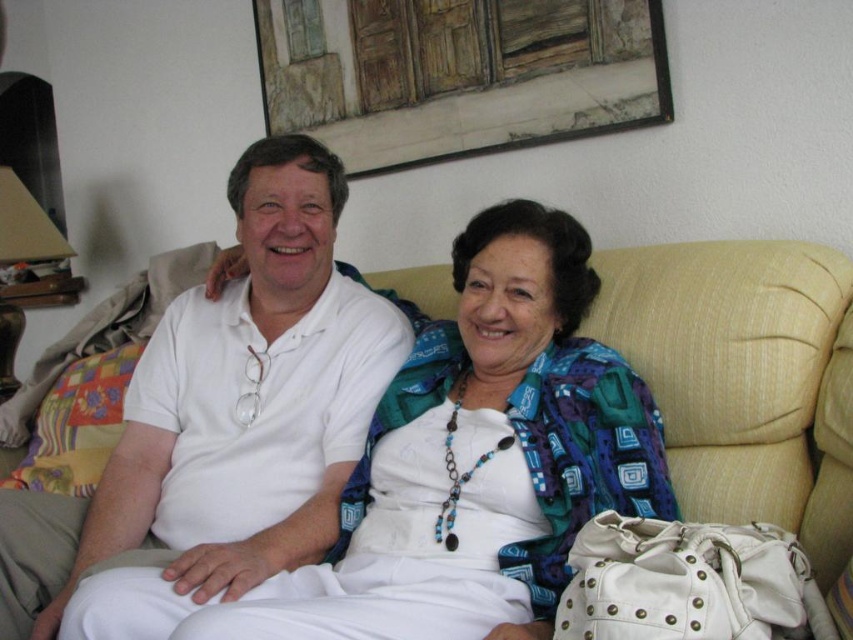
Is white matte shirt at center wider than beige fabric couch at center?

Yes.

This screenshot has width=853, height=640. In order to click on white matte shirt at center in this screenshot , I will do `click(228, 412)`.

You are a GUI agent. You are given a task and a screenshot of the screen. Output one action in this format:
    pyautogui.click(x=<x>, y=<y>)
    Task: Click on the white matte shirt at center
    The image size is (853, 640).
    Given the screenshot: What is the action you would take?
    pyautogui.click(x=228, y=412)